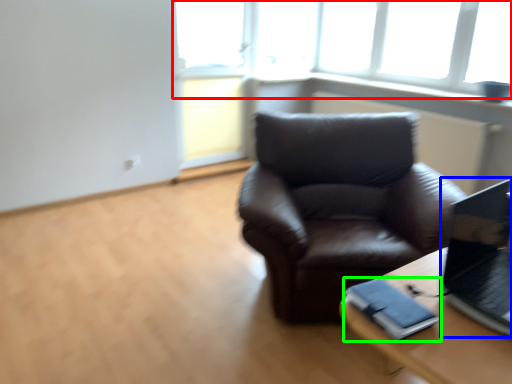
Question: Which object is positioned farthest from window (highlighted by a red box)? Select from laptop (highlighted by a blue box) and binder (highlighted by a green box).

Choices:
 (A) laptop
 (B) binder

Answer: (B)